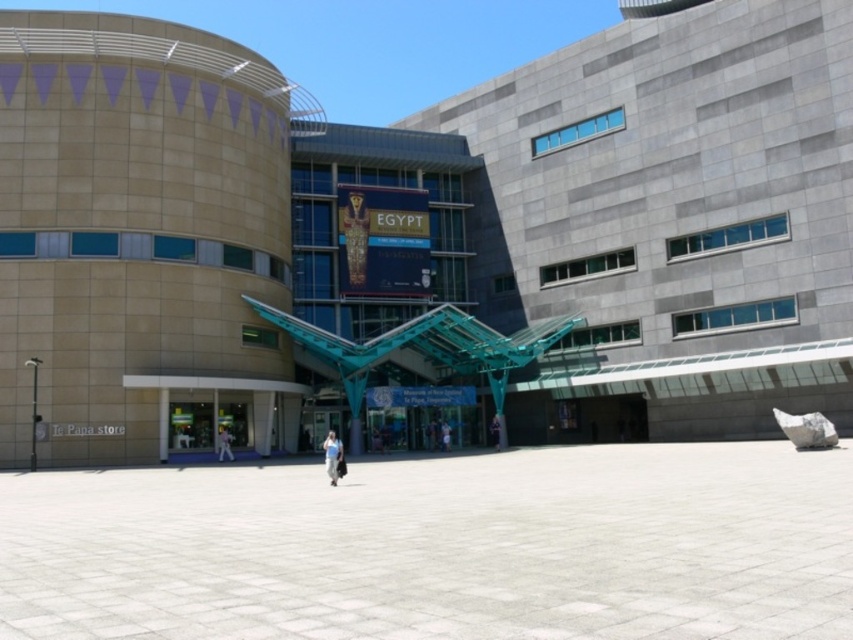
In the scene shown: You are standing in front of the museum and want to greet the person wearing dark blue jeans at center. Which direction should you walk to approach them from the light blue jeans at center?

The light blue jeans at center is in front of dark blue jeans at center, so to approach the dark blue jeans at center, you should walk backward away from the light blue jeans at center towards the direction of the dark blue jeans.

You are standing in front of the beige stone building at center and dark blue jeans at center. Which object is closer to you?

The beige stone building at center is closer to you than the dark blue jeans at center.